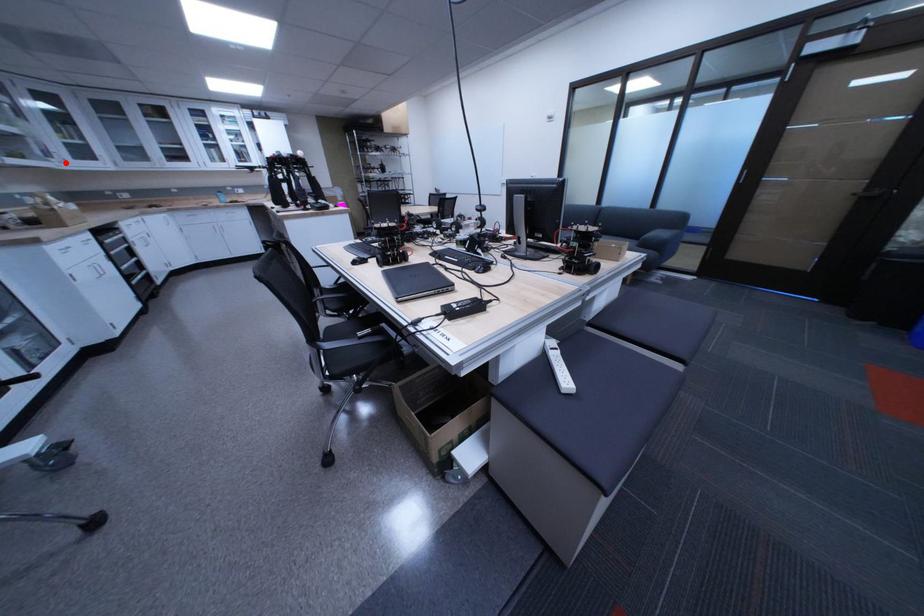
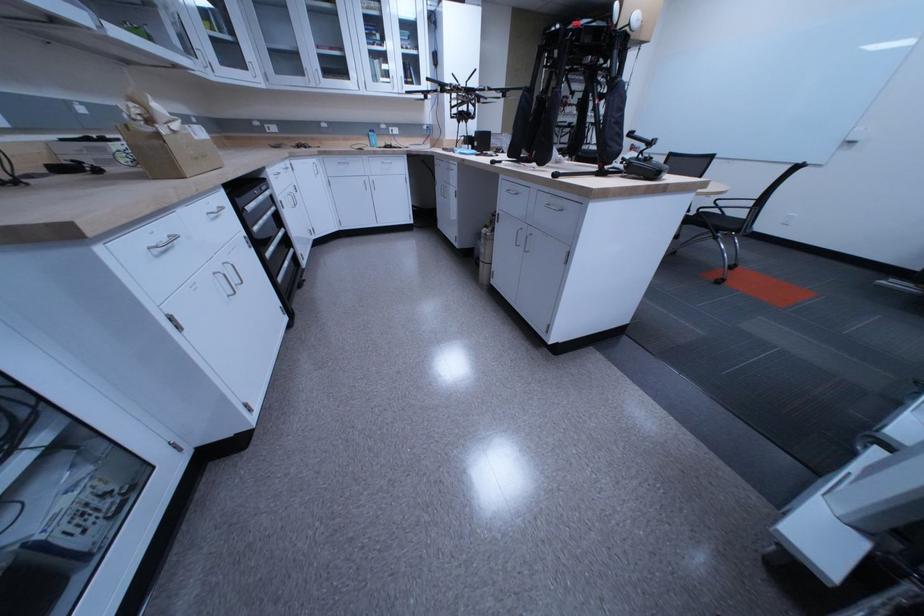
The point at the highlighted location is marked in the first image. Where is the corresponding point in the second image?

(205, 61)